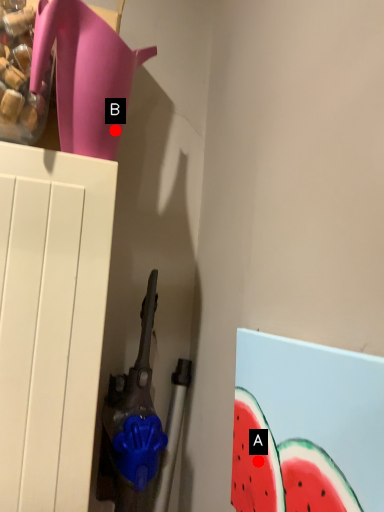
Question: Two points are circled on the image, labeled by A and B beside each circle. Among these points, which one is farthest from the camera?

Choices:
 (A) A is further
 (B) B is further

Answer: (B)